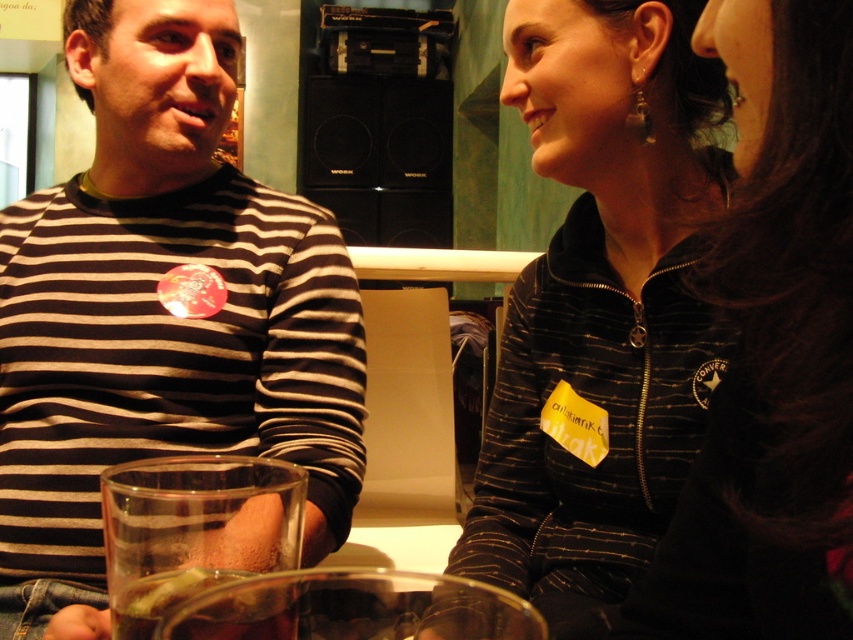
Is the position of striped fabric shirt at left less distant than that of translucent glass at lower left?

No, it is behind translucent glass at lower left.

Is striped fabric shirt at left to the right of translucent glass at lower left from the viewer's perspective?

No, striped fabric shirt at left is not to the right of translucent glass at lower left.

Find the location of a particular element. The width and height of the screenshot is (853, 640). striped fabric shirt at left is located at coordinates (161, 310).

Locate an element on the screen. This screenshot has width=853, height=640. striped fabric shirt at left is located at coordinates (161, 310).

Can you confirm if black striped jacket at upper right is smaller than black zip-up jacket at upper right?

Incorrect, black striped jacket at upper right is not smaller in size than black zip-up jacket at upper right.

Which is below, black striped jacket at upper right or black zip-up jacket at upper right?

black zip-up jacket at upper right is below.

The width and height of the screenshot is (853, 640). I want to click on black striped jacket at upper right, so click(601, 307).

What are the coordinates of `black striped jacket at upper right` in the screenshot? It's located at (601, 307).

From the picture: Is striped fabric shirt at left closer to camera compared to black striped jacket at upper right?

That is False.

This screenshot has width=853, height=640. I want to click on striped fabric shirt at left, so pyautogui.click(x=161, y=310).

At what (x,y) coordinates should I click in order to perform the action: click on striped fabric shirt at left. Please return your answer as a coordinate pair (x, y). Looking at the image, I should click on (161, 310).